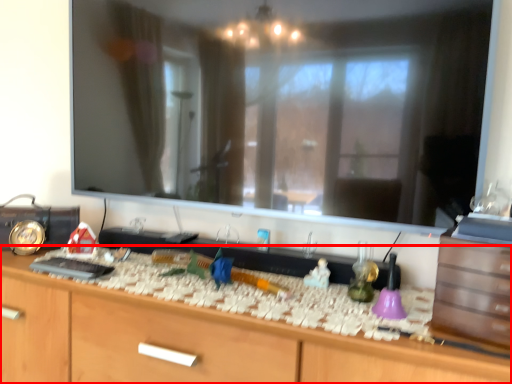
Question: Considering the relative positions of cabinetry (annotated by the red box) and drawer in the image provided, where is cabinetry (annotated by the red box) located with respect to the staircase?

Choices:
 (A) left
 (B) right

Answer: (A)